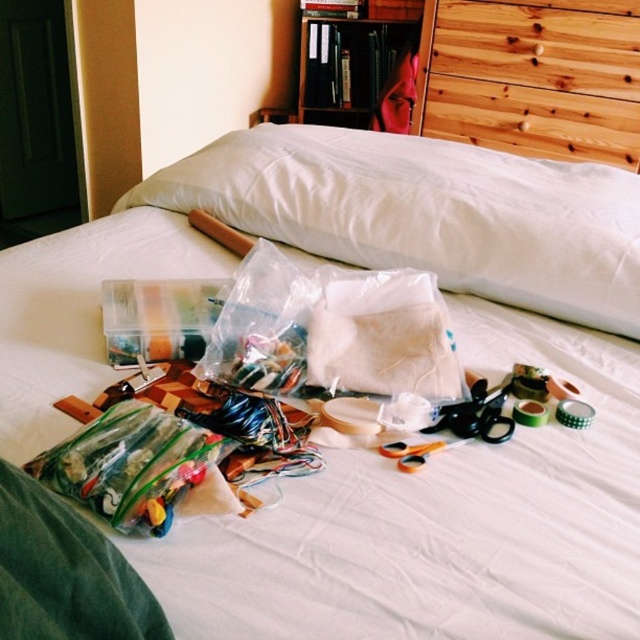
Question: Considering the real-world distances, which object is closest to the white fabric pillow at center?

Choices:
 (A) wooden at upper right
 (B) translucent plastic bag at center
 (C) wooden bookshelf at upper center

Answer: (B)

Question: Where is white fabric pillow at center located in relation to wooden at upper right in the image?

Choices:
 (A) above
 (B) below

Answer: (B)

Question: Does translucent plastic bag at center have a greater width compared to wooden bookshelf at upper center?

Choices:
 (A) no
 (B) yes

Answer: (A)

Question: Which object is the farthest from the translucent plastic bag at center?

Choices:
 (A) white fabric pillow at center
 (B) wooden bookshelf at upper center
 (C) wooden at upper right

Answer: (B)

Question: Observing the image, what is the correct spatial positioning of white fabric pillow at center in reference to translucent plastic bag at center?

Choices:
 (A) left
 (B) right

Answer: (B)

Question: Among these points, which one is farthest from the camera?

Choices:
 (A) click(321, 56)
 (B) click(170, 483)
 (C) click(518, 20)
 (D) click(397, 211)

Answer: (A)